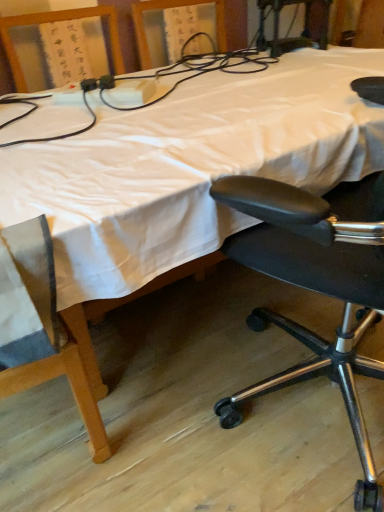
Question: From a real-world perspective, is white fabric bed at center physically above black leather office chair at right?

Choices:
 (A) yes
 (B) no

Answer: (B)

Question: Is the position of white fabric bed at center less distant than that of black leather office chair at right?

Choices:
 (A) no
 (B) yes

Answer: (A)

Question: Is white fabric bed at center further to camera compared to black leather office chair at right?

Choices:
 (A) yes
 (B) no

Answer: (A)

Question: From the image's perspective, does white fabric bed at center appear higher than black leather office chair at right?

Choices:
 (A) no
 (B) yes

Answer: (B)

Question: Can you confirm if white fabric bed at center is thinner than black leather office chair at right?

Choices:
 (A) no
 (B) yes

Answer: (A)

Question: Considering their positions, is white plastic power strip at upper left located in front of or behind white fabric bed at center?

Choices:
 (A) front
 (B) behind

Answer: (B)

Question: Considering the positions of white plastic power strip at upper left and white fabric bed at center in the image, is white plastic power strip at upper left wider or thinner than white fabric bed at center?

Choices:
 (A) wide
 (B) thin

Answer: (B)

Question: Is white plastic power strip at upper left situated inside white fabric bed at center or outside?

Choices:
 (A) outside
 (B) inside

Answer: (B)

Question: From the image's perspective, is white plastic power strip at upper left positioned above or below white fabric bed at center?

Choices:
 (A) above
 (B) below

Answer: (A)

Question: Is white plastic power strip at upper left inside or outside of black leather office chair at right?

Choices:
 (A) inside
 (B) outside

Answer: (B)

Question: Is white plastic power strip at upper left to the left or to the right of black leather office chair at right in the image?

Choices:
 (A) right
 (B) left

Answer: (B)

Question: Is point (266, 56) positioned closer to the camera than point (369, 474)?

Choices:
 (A) farther
 (B) closer

Answer: (A)

Question: Considering the positions of white plastic power strip at upper left and black leather office chair at right in the image, is white plastic power strip at upper left wider or thinner than black leather office chair at right?

Choices:
 (A) wide
 (B) thin

Answer: (B)

Question: Relative to white plastic power strip at upper left, is white fabric bed at center in front or behind?

Choices:
 (A) front
 (B) behind

Answer: (A)

Question: In the image, is white fabric bed at center on the left side or the right side of white plastic power strip at upper left?

Choices:
 (A) right
 (B) left

Answer: (A)